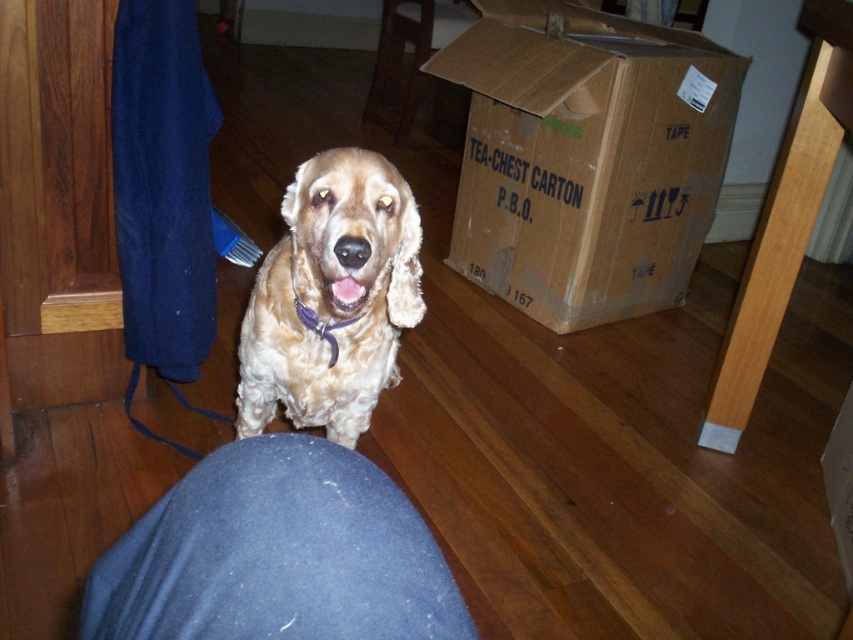
Can you confirm if brown cardboard box at center is wider than purple fabric neckband at center?

Yes.

Does brown cardboard box at center have a greater height compared to purple fabric neckband at center?

Yes, brown cardboard box at center is taller than purple fabric neckband at center.

Is point (676, 118) in front of point (347, 317)?

No, it is not.

Locate an element on the screen. The width and height of the screenshot is (853, 640). brown cardboard box at center is located at coordinates 585,157.

Can you confirm if brown cardboard box at center is positioned below golden fur dog at center?

No.

Which is in front, point (634, 61) or point (346, 330)?

Point (346, 330) is in front.

Image resolution: width=853 pixels, height=640 pixels. Identify the location of brown cardboard box at center. (585, 157).

Is denim at lower center bigger than purple fabric neckband at center?

Yes.

Can you confirm if denim at lower center is shorter than purple fabric neckband at center?

No.

Does point (422, 602) come closer to viewer compared to point (329, 336)?

Yes, point (422, 602) is in front of point (329, 336).

Where is `denim at lower center`? denim at lower center is located at coordinates (276, 554).